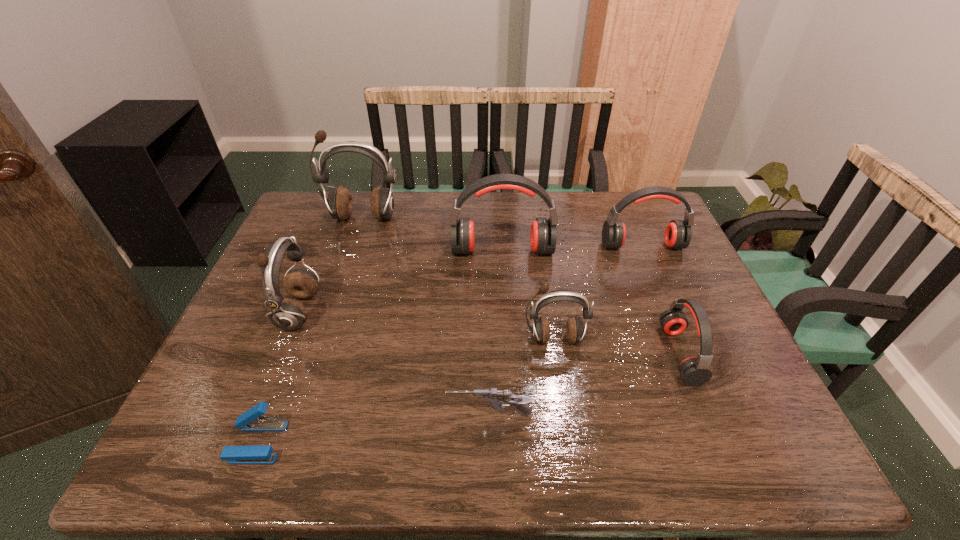
I want to click on vacant region located 0.220m at the barrel of the seventh farthest object, so click(x=343, y=415).

Where is `free region located at the barrel of the seventh farthest object`? free region located at the barrel of the seventh farthest object is located at coordinates (423, 415).

Locate an element on the screen. This screenshot has width=960, height=540. vacant space located on the right of the blue stapler is located at coordinates (432, 442).

This screenshot has width=960, height=540. I want to click on object positioned at the far edge, so click(x=340, y=204).

This screenshot has width=960, height=540. In order to click on object that is at the near edge in this screenshot , I will do `click(252, 420)`.

Image resolution: width=960 pixels, height=540 pixels. I want to click on stapler situated at the left edge, so click(252, 420).

You are a GUI agent. You are given a task and a screenshot of the screen. Output one action in this format:
    pyautogui.click(x=<x>, y=<y>)
    Task: Click on the object at the far left corner
    This screenshot has width=960, height=540.
    Given the screenshot: What is the action you would take?
    pyautogui.click(x=340, y=204)

Locate an element on the screen. This screenshot has width=960, height=540. object located in the near left corner section of the desktop is located at coordinates (252, 420).

In the image, there is a desktop. At what (x,y) coordinates should I click in order to perform the action: click on free region at the far edge. Please return your answer as a coordinate pair (x, y). Looking at the image, I should click on [x=522, y=213].

The image size is (960, 540). What are the coordinates of `vacant region at the near edge of the desktop` in the screenshot? It's located at (448, 462).